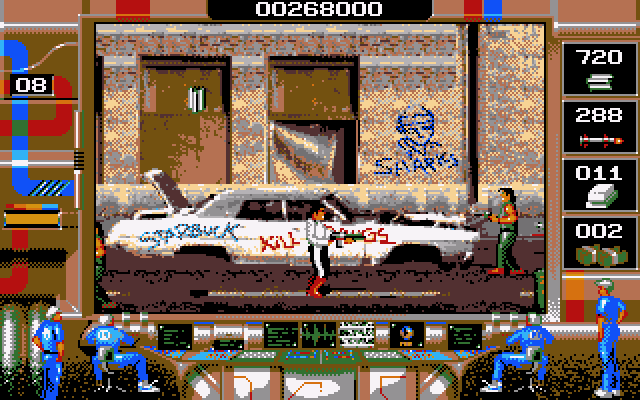
Find the location of a particular element. Image resolution: width=640 pixels, height=400 pixels. desk chairs is located at coordinates (532, 355), (100, 353).